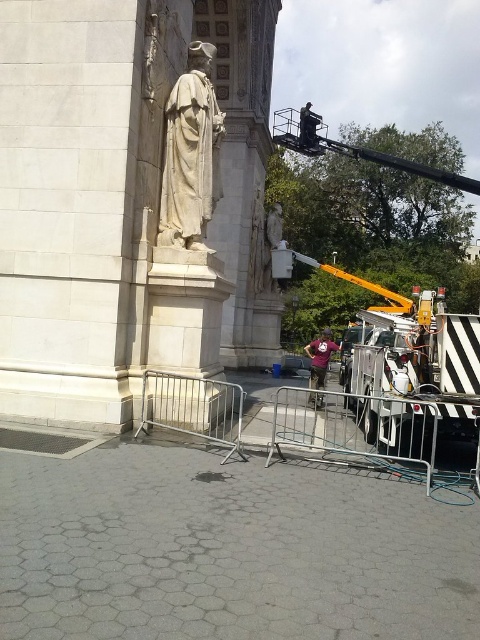
You are a visitor trying to take a photo of the white marble statue at upper left without any obstructions. Is the purple fabric construction worker at center blocking your view of the statue?

The white marble statue at upper left is in front of the purple fabric construction worker at center, so the construction worker is behind the statue and not blocking your view.

Looking at this image, you are a safety inspector checking the distance between the white marble statue at upper left and the purple fabric construction worker at center. According to safety regulations, workers must stay at least 5 meters away from historical structures. Is the current distance compliant?

The white marble statue at upper left is 5.35 meters from the purple fabric construction worker at center, which meets the requirement of staying at least 5 meters away. The distance is compliant with safety regulations.

You are a visitor trying to take a photo of the white marble statue at upper left without the purple fabric construction worker at center appearing in the frame. Is this possible based on their positions?

The white marble statue at upper left is above the purple fabric construction worker at center, so if you position yourself below the statue and aim upwards, you can capture the statue without the worker blocking the view.